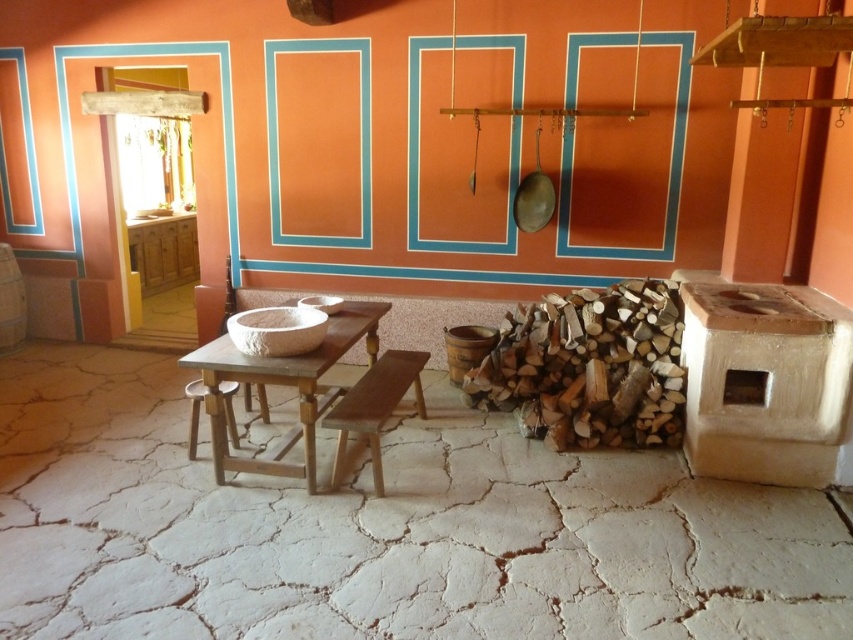
Question: Which object is farther from the camera taking this photo?

Choices:
 (A) wooden stool at lower left
 (B) wooden bench at center
 (C) wooden table at center

Answer: (A)

Question: Which point is closer to the camera?

Choices:
 (A) (225, 340)
 (B) (339, 449)
 (C) (196, 442)

Answer: (B)

Question: Which point is farther to the camera?

Choices:
 (A) wooden stool at lower left
 (B) wooden bench at center

Answer: (A)

Question: Is the position of wooden bench at center more distant than that of wooden stool at lower left?

Choices:
 (A) no
 (B) yes

Answer: (A)

Question: Is the position of wooden table at center less distant than that of wooden bench at center?

Choices:
 (A) no
 (B) yes

Answer: (B)

Question: Is wooden table at center below wooden stool at lower left?

Choices:
 (A) yes
 (B) no

Answer: (B)